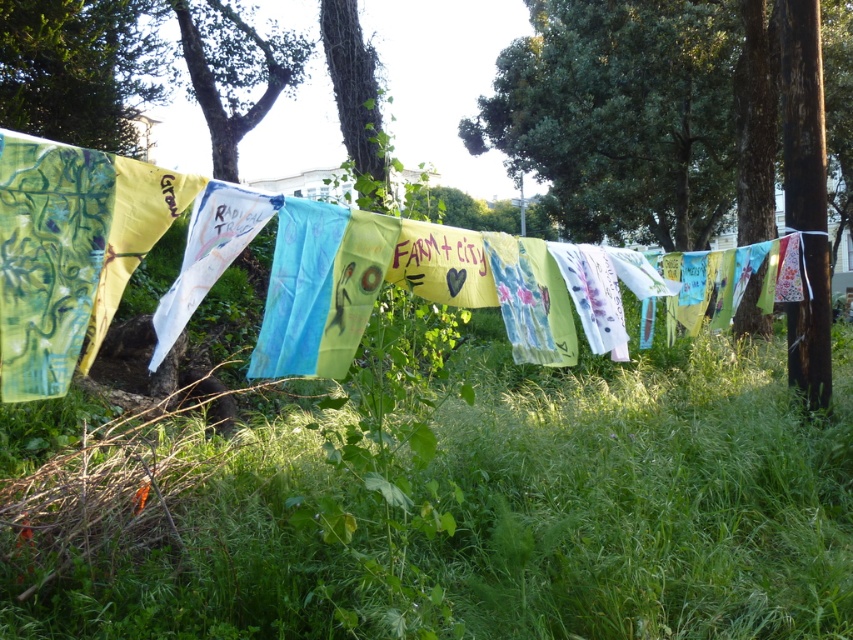
Where is `green grass at lower center`? This screenshot has width=853, height=640. green grass at lower center is located at coordinates (642, 497).

This screenshot has height=640, width=853. Describe the element at coordinates (642, 497) in the screenshot. I see `green grass at lower center` at that location.

I want to click on green grass at lower center, so click(642, 497).

Where is `green grass at lower center`? green grass at lower center is located at coordinates (642, 497).

Does textile banners at center have a greater height compared to green leafy tree at upper left?

No, textile banners at center is not taller than green leafy tree at upper left.

Identify the location of textile banners at center. The image size is (853, 640). (70, 253).

Find the location of a particular element. textile banners at center is located at coordinates (70, 253).

In the scene shown: Is green grass at lower center thinner than green leafy tree at upper left?

Incorrect, green grass at lower center's width is not less than green leafy tree at upper left's.

Who is more distant from viewer, (309, 516) or (155, 54)?

The point (155, 54) is more distant.

Is point (341, 564) behind point (97, 60)?

That is False.

Find the location of a particular element. This screenshot has height=640, width=853. green grass at lower center is located at coordinates (642, 497).